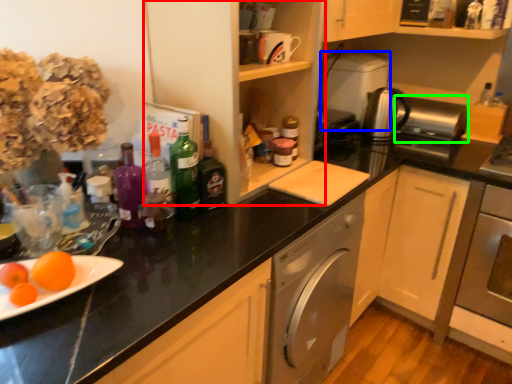
Question: Which object is positioned farthest from cabinetry (highlighted by a red box)? Select from appliance (highlighted by a blue box) and appliance (highlighted by a green box).

Choices:
 (A) appliance
 (B) appliance

Answer: (B)